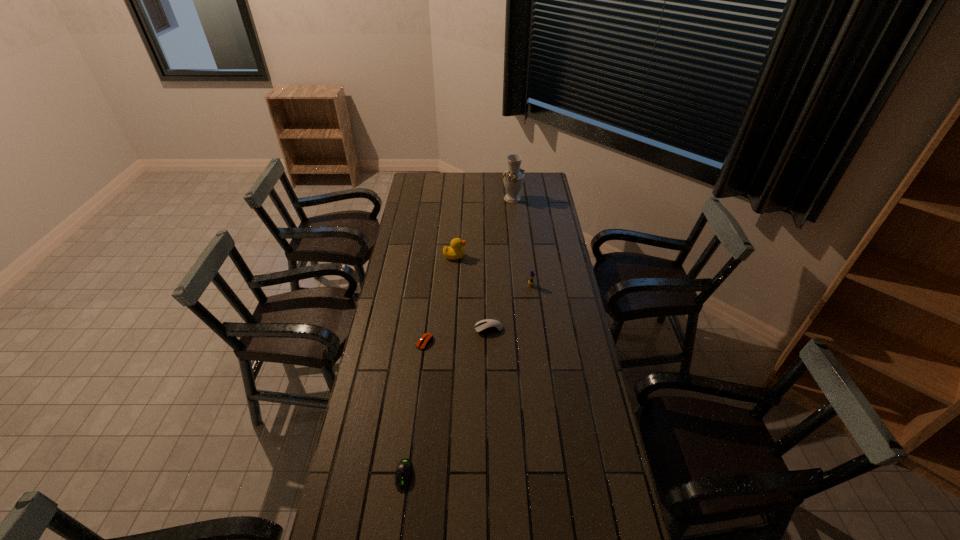
You are a GUI agent. You are given a task and a screenshot of the screen. Output one action in this format:
    pyautogui.click(x=<x>, y=<y>)
    Task: Click on the vase
    The width and height of the screenshot is (960, 540).
    Given the screenshot: What is the action you would take?
    pyautogui.click(x=513, y=178)

Locate an element on the screen. The width and height of the screenshot is (960, 540). the tallest object is located at coordinates (513, 178).

You are a GUI agent. You are given a task and a screenshot of the screen. Output one action in this format:
    pyautogui.click(x=<x>, y=<y>)
    Task: Click on the second tallest object
    This screenshot has height=540, width=960.
    Given the screenshot: What is the action you would take?
    pyautogui.click(x=455, y=251)

Identify the location of the third object from left to right. (455, 251).

At what (x,y) coordinates should I click in order to perform the action: click on duckling. Please return your answer as a coordinate pair (x, y). Looking at the image, I should click on (530, 282).

The height and width of the screenshot is (540, 960). In order to click on the third tallest object in this screenshot , I will do `click(530, 282)`.

Find the location of `the third shortest object`. the third shortest object is located at coordinates (488, 325).

The image size is (960, 540). Identify the location of the fourth object from left to right. (488, 325).

The height and width of the screenshot is (540, 960). I want to click on the nearest object, so tap(404, 471).

Where is `the nearest computer mouse`? the nearest computer mouse is located at coordinates (404, 471).